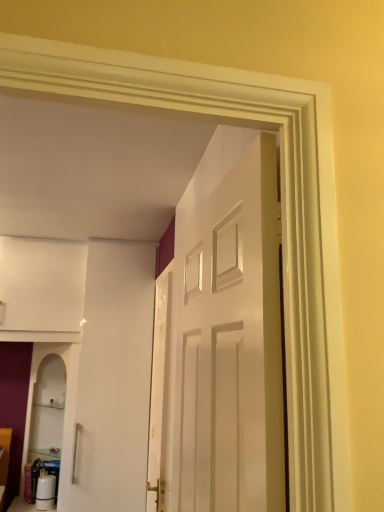
Question: Is white glossy door at center taller than white glossy door at center?

Choices:
 (A) no
 (B) yes

Answer: (A)

Question: Is white glossy door at center positioned in front of white glossy door at center?

Choices:
 (A) yes
 (B) no

Answer: (A)

Question: Considering the relative positions of white glossy door at center and white glossy door at center in the image provided, is white glossy door at center to the left of white glossy door at center from the viewer's perspective?

Choices:
 (A) yes
 (B) no

Answer: (B)

Question: Is there a large distance between white glossy door at center and white glossy door at center?

Choices:
 (A) yes
 (B) no

Answer: (B)

Question: From the image's perspective, is white glossy door at center located beneath white glossy door at center?

Choices:
 (A) yes
 (B) no

Answer: (B)

Question: Can you confirm if white glossy door at center is thinner than white glossy door at center?

Choices:
 (A) yes
 (B) no

Answer: (B)

Question: Is white glossy door at center not close to white glossy door at center?

Choices:
 (A) no
 (B) yes

Answer: (A)

Question: Is white glossy door at center oriented away from white glossy door at center?

Choices:
 (A) yes
 (B) no

Answer: (B)

Question: Does white glossy door at center have a lesser height compared to white glossy door at center?

Choices:
 (A) yes
 (B) no

Answer: (B)

Question: Is white glossy door at center wider than white glossy door at center?

Choices:
 (A) yes
 (B) no

Answer: (B)

Question: Is the position of white glossy door at center more distant than that of white glossy door at center?

Choices:
 (A) yes
 (B) no

Answer: (A)

Question: Is white glossy door at center oriented towards white glossy door at center?

Choices:
 (A) no
 (B) yes

Answer: (A)

Question: Does point (244, 206) appear closer or farther from the camera than point (157, 415)?

Choices:
 (A) closer
 (B) farther

Answer: (A)